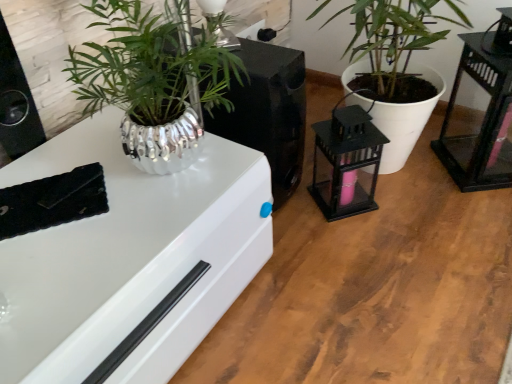
Identify the location of metallic silver plant pot at upper left, which ranks as the 1th appliance in left-to-right order. The image size is (512, 384). (268, 112).

This screenshot has height=384, width=512. Identify the location of black glass table at right. (478, 120).

This screenshot has width=512, height=384. What do you see at coordinates (346, 162) in the screenshot?
I see `black metal lantern at center-right, acting as the 2th appliance starting from the left` at bounding box center [346, 162].

The height and width of the screenshot is (384, 512). Find the location of `metallic silver plant pot at upper left, acting as the 2th appliance starting from the right`. metallic silver plant pot at upper left, acting as the 2th appliance starting from the right is located at coordinates (268, 112).

Is white matte plant pot at center located outside black glass table at right?

Absolutely, white matte plant pot at center is external to black glass table at right.

Is white matte plant pot at center oriented away from black glass table at right?

No.

Looking at this image, considering the relative sizes of white matte plant pot at center and black glass table at right in the image provided, is white matte plant pot at center thinner than black glass table at right?

No, white matte plant pot at center is not thinner than black glass table at right.

From a real-world perspective, who is located lower, black metal lantern at center-right, the first appliance in the right-to-left sequence, or metallic silver plant pot at upper left, acting as the 2th appliance starting from the right?

black metal lantern at center-right, the first appliance in the right-to-left sequence.

In terms of width, does black metal lantern at center-right, acting as the 2th appliance starting from the left, look wider or thinner when compared to metallic silver plant pot at upper left, which ranks as the 1th appliance in left-to-right order?

black metal lantern at center-right, acting as the 2th appliance starting from the left, is thinner than metallic silver plant pot at upper left, which ranks as the 1th appliance in left-to-right order.

Does point (379, 150) come farther from viewer compared to point (253, 129)?

Yes.

Is black metal lantern at center-right, acting as the 2th appliance starting from the left, turned away from black glass table at right?

No, black metal lantern at center-right, acting as the 2th appliance starting from the left, is not facing away from black glass table at right.

From the image's perspective, is black metal lantern at center-right, acting as the 2th appliance starting from the left, positioned above or below black glass table at right?

Clearly, from the image's perspective, black metal lantern at center-right, acting as the 2th appliance starting from the left, is below black glass table at right.

Is black metal lantern at center-right, acting as the 2th appliance starting from the left, outside of black glass table at right?

Absolutely, black metal lantern at center-right, acting as the 2th appliance starting from the left, is external to black glass table at right.

Identify the location of table located in front of the black metal lantern at center-right, acting as the 2th appliance starting from the left. (478, 120).

Is white matte plant pot at center oriented away from metallic silver plant pot at upper left, which ranks as the 1th appliance in left-to-right order?

No, white matte plant pot at center is not facing the opposite direction of metallic silver plant pot at upper left, which ranks as the 1th appliance in left-to-right order.

How many degrees apart are the facing directions of white matte plant pot at center and metallic silver plant pot at upper left, which ranks as the 1th appliance in left-to-right order?

They differ by 0.72 degrees in their facing directions.

Based on the photo, from the image's perspective, does white matte plant pot at center appear lower than metallic silver plant pot at upper left, which ranks as the 1th appliance in left-to-right order?

No, from the image's perspective, white matte plant pot at center is not beneath metallic silver plant pot at upper left, which ranks as the 1th appliance in left-to-right order.

Does white matte plant pot at center have a greater width compared to metallic silver plant pot at upper left, which ranks as the 1th appliance in left-to-right order?

Yes, white matte plant pot at center is wider than metallic silver plant pot at upper left, which ranks as the 1th appliance in left-to-right order.

Looking at this image, who is shorter, black glass table at right or black metal lantern at center-right, the first appliance in the right-to-left sequence?

Standing shorter between the two is black metal lantern at center-right, the first appliance in the right-to-left sequence.

Is black glass table at right not close to black metal lantern at center-right, acting as the 2th appliance starting from the left?

No, black glass table at right is in close proximity to black metal lantern at center-right, acting as the 2th appliance starting from the left.

Between black glass table at right and black metal lantern at center-right, the first appliance in the right-to-left sequence, which one has smaller size?

black metal lantern at center-right, the first appliance in the right-to-left sequence.

What are the coordinates of `table above the black metal lantern at center-right, acting as the 2th appliance starting from the left (from a real-world perspective)` in the screenshot? It's located at (478, 120).

You are a GUI agent. You are given a task and a screenshot of the screen. Output one action in this format:
    pyautogui.click(x=<x>, y=<y>)
    Task: Click on the houseplant above the metallic silver plant pot at upper left, acting as the 2th appliance starting from the right (from a real-world perspective)
    
    Given the screenshot: What is the action you would take?
    pyautogui.click(x=396, y=63)

Considering the positions of point (241, 88) and point (440, 81), is point (241, 88) closer or farther from the camera than point (440, 81)?

Clearly, point (241, 88) is closer to the camera than point (440, 81).

Between metallic silver plant pot at upper left, which ranks as the 1th appliance in left-to-right order, and white matte plant pot at center, which one is positioned in front?

white matte plant pot at center.

Based on the photo, is metallic silver plant pot at upper left, which ranks as the 1th appliance in left-to-right order, not near white matte plant pot at center?

No, there isn't a large distance between metallic silver plant pot at upper left, which ranks as the 1th appliance in left-to-right order, and white matte plant pot at center.

From the image's perspective, between black metal lantern at center-right, the first appliance in the right-to-left sequence, and white matte plant pot at center, who is located below?

black metal lantern at center-right, the first appliance in the right-to-left sequence, is shown below in the image.

Measure the distance from black metal lantern at center-right, acting as the 2th appliance starting from the left, to white matte plant pot at center.

A distance of 6.54 inches exists between black metal lantern at center-right, acting as the 2th appliance starting from the left, and white matte plant pot at center.

From a real-world perspective, who is located higher, black metal lantern at center-right, acting as the 2th appliance starting from the left, or white matte plant pot at center?

From a 3D spatial view, white matte plant pot at center is above.

Could you tell me if black metal lantern at center-right, acting as the 2th appliance starting from the left, is facing white matte plant pot at center?

No, black metal lantern at center-right, acting as the 2th appliance starting from the left, is not oriented towards white matte plant pot at center.

Locate an element on the screen. Image resolution: width=512 pixels, height=384 pixels. houseplant on the left of black glass table at right is located at coordinates (396, 63).

Where is `appliance directly beneath the metallic silver plant pot at upper left, acting as the 2th appliance starting from the right (from a real-world perspective)`? appliance directly beneath the metallic silver plant pot at upper left, acting as the 2th appliance starting from the right (from a real-world perspective) is located at coordinates (346, 162).

Consider the image. When comparing their distances from white matte plant pot at center, does black metal lantern at center-right, acting as the 2th appliance starting from the left, or black glass table at right seem further?

black glass table at right is further to white matte plant pot at center.

When comparing their distances from black glass table at right, does metallic silver plant pot at upper left, which ranks as the 1th appliance in left-to-right order, or black metal lantern at center-right, acting as the 2th appliance starting from the left, seem further?

metallic silver plant pot at upper left, which ranks as the 1th appliance in left-to-right order.

Which object lies further to the anchor point black metal lantern at center-right, acting as the 2th appliance starting from the left, metallic silver plant pot at upper left, which ranks as the 1th appliance in left-to-right order, or black glass table at right?

black glass table at right is further to black metal lantern at center-right, acting as the 2th appliance starting from the left.

Based on their spatial positions, is metallic silver plant pot at upper left, acting as the 2th appliance starting from the right, or black glass table at right closer to white matte plant pot at center?

Based on the image, black glass table at right appears to be nearer to white matte plant pot at center.

Looking at this image, looking at the image, which one is located further to black metal lantern at center-right, acting as the 2th appliance starting from the left, black glass table at right or metallic silver plant pot at upper left, acting as the 2th appliance starting from the right?

Based on the image, black glass table at right appears to be further to black metal lantern at center-right, acting as the 2th appliance starting from the left.

Which object lies nearer to the anchor point black metal lantern at center-right, the first appliance in the right-to-left sequence, black glass table at right or white matte plant pot at center?

white matte plant pot at center.

Considering their positions, is metallic silver plant pot at upper left, acting as the 2th appliance starting from the right, positioned further to black metal lantern at center-right, the first appliance in the right-to-left sequence, than white matte plant pot at center?

white matte plant pot at center is positioned further to the anchor black metal lantern at center-right, the first appliance in the right-to-left sequence.

Estimate the real-world distances between objects in this image. Which object is further from black metal lantern at center-right, acting as the 2th appliance starting from the left, white matte plant pot at center or metallic silver plant pot at upper left, which ranks as the 1th appliance in left-to-right order?

The object further to black metal lantern at center-right, acting as the 2th appliance starting from the left, is white matte plant pot at center.

I want to click on appliance between metallic silver plant pot at upper left, acting as the 2th appliance starting from the right, and black glass table at right from left to right, so click(346, 162).

The height and width of the screenshot is (384, 512). I want to click on houseplant located between black metal lantern at center-right, acting as the 2th appliance starting from the left, and black glass table at right in the left-right direction, so click(396, 63).

Find the location of a particular element. The width and height of the screenshot is (512, 384). appliance between metallic silver plant pot at upper left, acting as the 2th appliance starting from the right, and white matte plant pot at center from left to right is located at coordinates (346, 162).

Locate an element on the screen. This screenshot has width=512, height=384. houseplant between metallic silver plant pot at upper left, acting as the 2th appliance starting from the right, and black glass table at right from left to right is located at coordinates (396, 63).